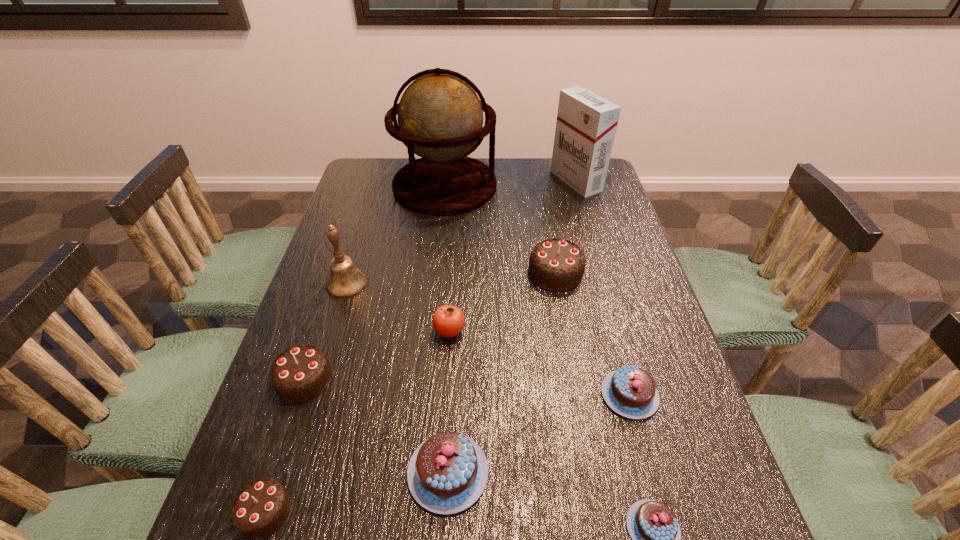
At what (x,y) coordinates should I click in order to perform the action: click on free region at the far edge of the desktop. Please return your answer as a coordinate pair (x, y). Looking at the image, I should click on (533, 183).

Locate an element on the screen. This screenshot has width=960, height=540. vacant space at the left edge of the desktop is located at coordinates (267, 454).

Where is `blank area at the right edge`? This screenshot has height=540, width=960. blank area at the right edge is located at coordinates (631, 280).

You are a GUI agent. You are given a task and a screenshot of the screen. Output one action in this format:
    pyautogui.click(x=<x>, y=<y>)
    Task: Click on the free region at the far left corner
    The height and width of the screenshot is (540, 960).
    Given the screenshot: What is the action you would take?
    pyautogui.click(x=371, y=189)

In the image, there is a desktop. Where is `vacant space at the far right corner`? The width and height of the screenshot is (960, 540). vacant space at the far right corner is located at coordinates (607, 177).

This screenshot has width=960, height=540. I want to click on free space between the smallest chocolate chocolate cake and the fifth farthest object, so click(x=357, y=421).

I want to click on vacant space that's between the biggest pink chocolate cake and the cigarette case, so click(x=512, y=327).

At what (x,y) coordinates should I click in order to perform the action: click on free area in between the cigarette case and the globe. Please return your answer as a coordinate pair (x, y). The width and height of the screenshot is (960, 540). Looking at the image, I should click on (511, 183).

At what (x,y) coordinates should I click in order to perform the action: click on empty space that is in between the second nearest chocolate chocolate cake and the nearest chocolate chocolate cake. Please return your answer as a coordinate pair (x, y). The height and width of the screenshot is (540, 960). Looking at the image, I should click on (284, 444).

Where is `blank region between the cigarette case and the second smallest chocolate chocolate cake`? The width and height of the screenshot is (960, 540). blank region between the cigarette case and the second smallest chocolate chocolate cake is located at coordinates (440, 280).